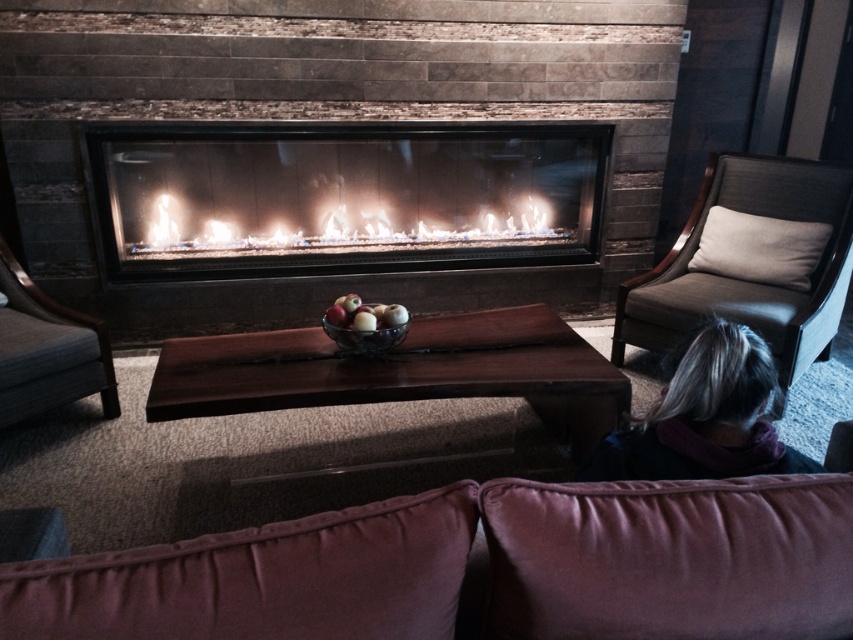
Question: Which of the following is the farthest from the observer?

Choices:
 (A) velvet maroon couch at lower center
 (B) dark gray fabric armchair at left
 (C) matte glass fireplace at center

Answer: (C)

Question: Which of the following is the closest to the observer?

Choices:
 (A) brown leather armchair at right
 (B) dark gray fabric armchair at left

Answer: (B)

Question: Does gray woolen scarf at lower right come in front of dark gray fabric armchair at left?

Choices:
 (A) yes
 (B) no

Answer: (A)

Question: Is dark gray fabric armchair at left positioned before white gas fire at center?

Choices:
 (A) yes
 (B) no

Answer: (A)

Question: Does brown leather armchair at right appear on the left side of white gas fire at center?

Choices:
 (A) no
 (B) yes

Answer: (A)

Question: Which object appears farthest from the camera in this image?

Choices:
 (A) dark gray fabric armchair at left
 (B) brown leather armchair at right

Answer: (B)